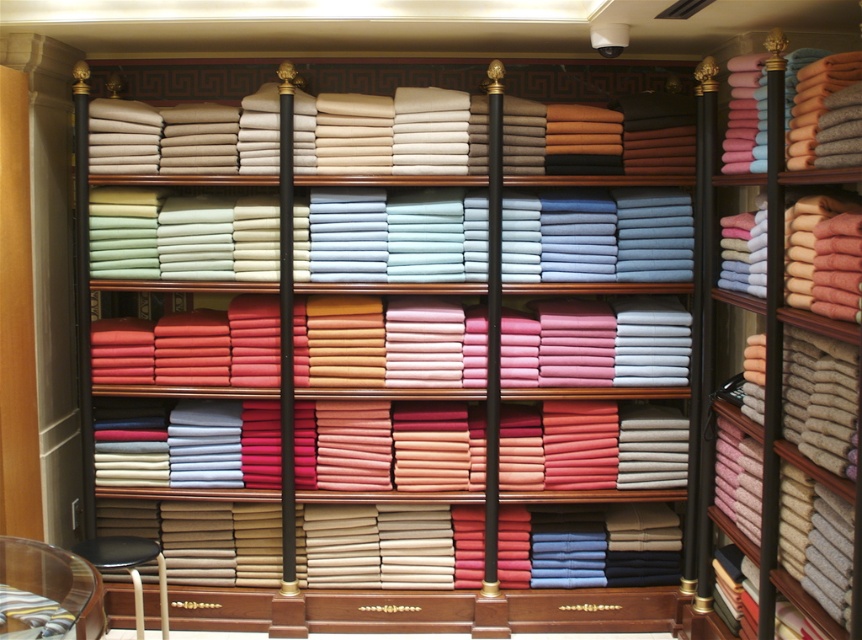
Is soft woolen towels at right closer to the viewer compared to black leather stool at lower left?

Yes, it is in front of black leather stool at lower left.

Is soft woolen towels at right smaller than black leather stool at lower left?

No.

Which is in front, point (694, 605) or point (148, 548)?

Positioned in front is point (148, 548).

In order to click on soft woolen towels at right in this screenshot , I will do `click(767, 212)`.

Does point (741, 259) come in front of point (10, 570)?

No, it is behind (10, 570).

Is soft woolen towels at right below transparent glass table at lower left?

Incorrect, soft woolen towels at right is not positioned below transparent glass table at lower left.

The width and height of the screenshot is (862, 640). I want to click on soft woolen towels at right, so click(x=767, y=212).

Is transparent glass table at lower left below black leather stool at lower left?

Actually, transparent glass table at lower left is above black leather stool at lower left.

Is transparent glass table at lower left to the right of black leather stool at lower left from the viewer's perspective?

Correct, you'll find transparent glass table at lower left to the right of black leather stool at lower left.

Consider the image. Who is more distant from viewer, (x=100, y=616) or (x=150, y=554)?

Positioned behind is point (x=150, y=554).

The height and width of the screenshot is (640, 862). I want to click on transparent glass table at lower left, so click(x=53, y=582).